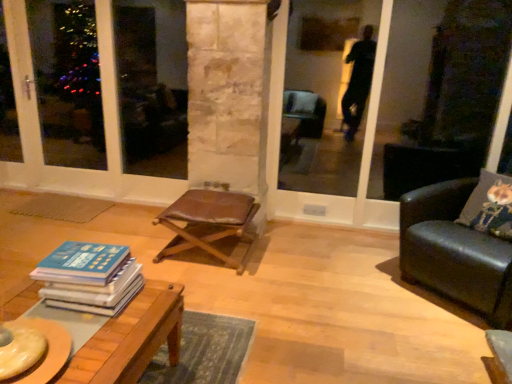
You are a GUI agent. You are given a task and a screenshot of the screen. Output one action in this format:
    pyautogui.click(x=<x>, y=<y>)
    Task: Click on the blue hardcover book at lower left
    The height and width of the screenshot is (384, 512).
    Given the screenshot: What is the action you would take?
    pyautogui.click(x=89, y=277)

Locate an element on the screen. The image size is (512, 384). fluffy beige pillow at right is located at coordinates (490, 205).

The width and height of the screenshot is (512, 384). What do you see at coordinates (104, 124) in the screenshot?
I see `white glass screen door at left` at bounding box center [104, 124].

The image size is (512, 384). What do you see at coordinates (208, 222) in the screenshot?
I see `leather stool at center` at bounding box center [208, 222].

This screenshot has width=512, height=384. Find the location of `transparent glass door at upper center`. transparent glass door at upper center is located at coordinates (391, 97).

Find the location of a particular element. This screenshot has width=512, height=384. blue hardcover book at lower left is located at coordinates (89, 277).

In the scene shown: Is black leather couch at right inside or outside of transparent glass door at upper center?

The correct answer is: outside.

Considering the positions of objects black leather couch at right and transparent glass door at upper center in the image provided, who is more to the left, black leather couch at right or transparent glass door at upper center?

From the viewer's perspective, transparent glass door at upper center appears more on the left side.

Which is less distant, (421, 220) or (376, 224)?

Point (421, 220).

How much distance is there between wooden table at lower left and black leather couch at right?

wooden table at lower left is 5.42 feet away from black leather couch at right.

From the image's perspective, is wooden table at lower left located above or below black leather couch at right?

wooden table at lower left is situated lower than black leather couch at right in the image.

Is wooden table at lower left completely or partially outside of black leather couch at right?

Yes, wooden table at lower left is not within black leather couch at right.

Is fluffy beige pillow at right positioned with its back to blue hardcover book at lower left?

fluffy beige pillow at right does not have its back to blue hardcover book at lower left.

Can you confirm if fluffy beige pillow at right is taller than blue hardcover book at lower left?

Yes.

Consider the image. Considering the sizes of objects blue hardcover book at lower left and leather stool at center in the image provided, who is bigger, blue hardcover book at lower left or leather stool at center?

leather stool at center.

Who is shorter, blue hardcover book at lower left or leather stool at center?

With less height is blue hardcover book at lower left.

At what (x,y) coordinates should I click in order to perform the action: click on chair lying on the right of blue hardcover book at lower left. Please return your answer as a coordinate pair (x, y). This screenshot has height=384, width=512. Looking at the image, I should click on (208, 222).

Is blue hardcover book at lower left next to leather stool at center?

blue hardcover book at lower left and leather stool at center are clearly separated.

Is blue hardcover book at lower left thinner than wooden table at lower left?

Yes, blue hardcover book at lower left is thinner than wooden table at lower left.

From the image's perspective, is blue hardcover book at lower left over wooden table at lower left?

Yes, from the image's perspective, blue hardcover book at lower left is over wooden table at lower left.

Is blue hardcover book at lower left placed right next to wooden table at lower left?

No, blue hardcover book at lower left is not touching wooden table at lower left.

From the image's perspective, is black leather couch at right above fluffy beige pillow at right?

No.

Which is behind, point (505, 269) or point (467, 221)?

The point (467, 221) is farther.

Between black leather couch at right and fluffy beige pillow at right, which one has smaller size?

fluffy beige pillow at right is smaller.

Can we say black leather couch at right lies outside fluffy beige pillow at right?

Yes.

At what (x,y) coordinates should I click in order to perform the action: click on chair that appears below the blue hardcover book at lower left (from a real-world perspective). Please return your answer as a coordinate pair (x, y). Looking at the image, I should click on (208, 222).

From the image's perspective, which one is positioned lower, leather stool at center or blue hardcover book at lower left?

blue hardcover book at lower left.

Considering the sizes of objects leather stool at center and blue hardcover book at lower left in the image provided, who is taller, leather stool at center or blue hardcover book at lower left?

With more height is leather stool at center.

Looking at their sizes, would you say leather stool at center is wider or thinner than blue hardcover book at lower left?

leather stool at center is wider than blue hardcover book at lower left.

Where is `glass door behind the black leather couch at right`? This screenshot has width=512, height=384. glass door behind the black leather couch at right is located at coordinates (391, 97).

This screenshot has height=384, width=512. What are the coordinates of `studio couch above the wooden table at lower left (from the image's perspective)` in the screenshot? It's located at (455, 251).

Based on the photo, looking at the image, which one is located further to blue hardcover book at lower left, transparent glass door at upper center or wooden table at lower left?

transparent glass door at upper center is further to blue hardcover book at lower left.

In the scene shown: Looking at the image, which one is located further to wooden table at lower left, leather stool at center or white glass screen door at left?

Among the two, white glass screen door at left is located further to wooden table at lower left.

Considering their positions, is white glass screen door at left positioned further to blue hardcover book at lower left than wooden table at lower left?

Among the two, white glass screen door at left is located further to blue hardcover book at lower left.

Which object lies nearer to the anchor point white glass screen door at left, leather stool at center or blue hardcover book at lower left?

leather stool at center lies closer to white glass screen door at left than the other object.

From the image, which object appears to be farther from leather stool at center, black leather couch at right or transparent glass door at upper center?

Among the two, transparent glass door at upper center is located further to leather stool at center.

From the image, which object appears to be farther from wooden table at lower left, black leather couch at right or transparent glass door at upper center?

The object further to wooden table at lower left is transparent glass door at upper center.

Based on their spatial positions, is black leather couch at right or leather stool at center further from wooden table at lower left?

black leather couch at right is positioned further to the anchor wooden table at lower left.

Based on their spatial positions, is transparent glass door at upper center or white glass screen door at left further from black leather couch at right?

Among the two, white glass screen door at left is located further to black leather couch at right.

The height and width of the screenshot is (384, 512). I want to click on chair positioned between wooden table at lower left and white glass screen door at left from near to far, so click(x=208, y=222).

This screenshot has height=384, width=512. What are the coordinates of `glass door between white glass screen door at left and fluffy beige pillow at right in the horizontal direction` in the screenshot? It's located at (391, 97).

Find the location of a particular element. Image resolution: width=512 pixels, height=384 pixels. chair between wooden table at lower left and transparent glass door at upper center from left to right is located at coordinates (208, 222).

Where is `chair between white glass screen door at left and black leather couch at right`? chair between white glass screen door at left and black leather couch at right is located at coordinates (208, 222).